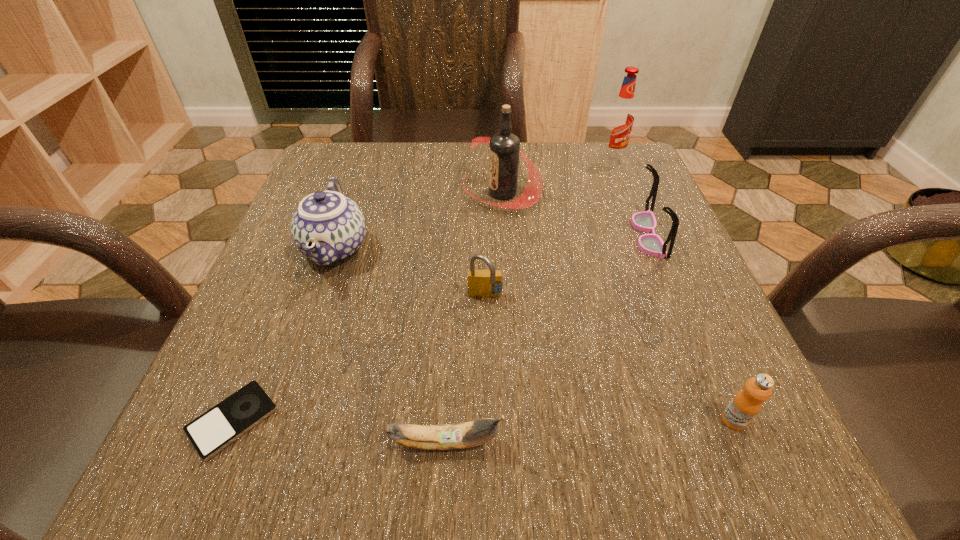
This screenshot has height=540, width=960. Identify the location of vacant area that satisfies the following two spatial constraints: 1. on the front label of the orange juice; 2. on the peel of the seventh tallest object. (743, 442).

I want to click on free location that satisfies the following two spatial constraints: 1. on the label of the left root beer; 2. on the side with the combination dials of the padlock, so click(x=508, y=298).

The height and width of the screenshot is (540, 960). In order to click on free point that satisfies the following two spatial constraints: 1. on the back side of the shortest object; 2. on the right side of the farthest object in this screenshot , I will do `click(344, 159)`.

Locate an element on the screen. blank area in the image that satisfies the following two spatial constraints: 1. on the label of the nearer root beer; 2. on the side with the combination dials of the padlock is located at coordinates (508, 298).